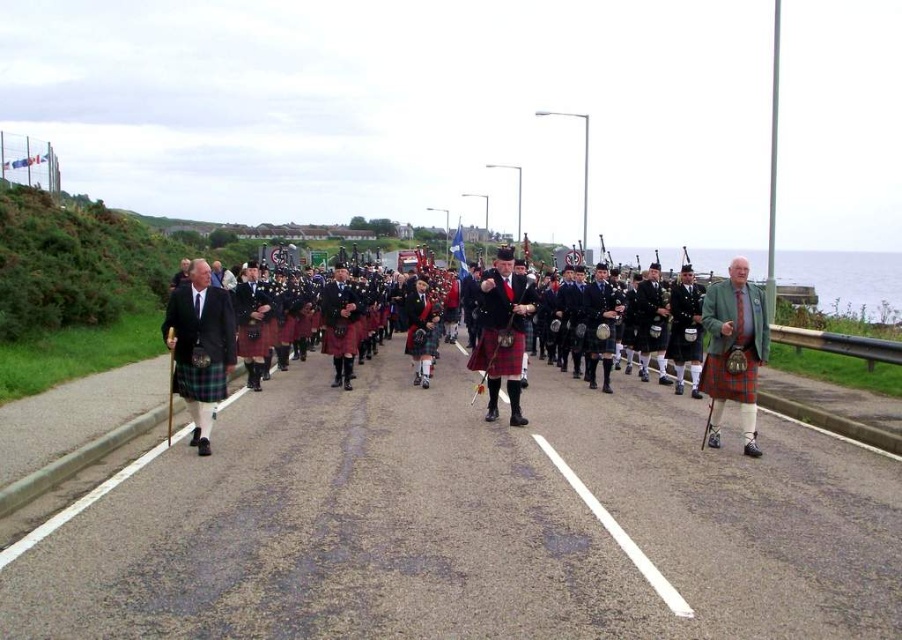
You are a photographer positioned on the road capturing the procession. You notice the matte black kilt at left and the red plaid kilt at center. Which kilt appears higher in your camera view?

The matte black kilt at left appears higher in the camera view because it is positioned above the red plaid kilt at center.

In the scene shown: You are a photographer positioned on the left side of the road capturing the formal procession. You notice the matte green jacket at right and the red plaid kilt at center. Which object should you zoom in on to focus on the taller one?

The matte green jacket at right is much taller than the red plaid kilt at center, so you should zoom in on the matte green jacket at right.

You are a photographer positioned on the road, aiming to capture the entire matte green jacket at right and red plaid kilt at center in a single frame. Given that your camera has a fixed focal length, which subject should you prioritize framing closer to ensure both fit without cropping?

The matte green jacket at right is wider than the red plaid kilt at center. To fit both in the frame without cropping, prioritize framing the wider matte green jacket at right closer to the camera, as its greater width requires more space in the composition.